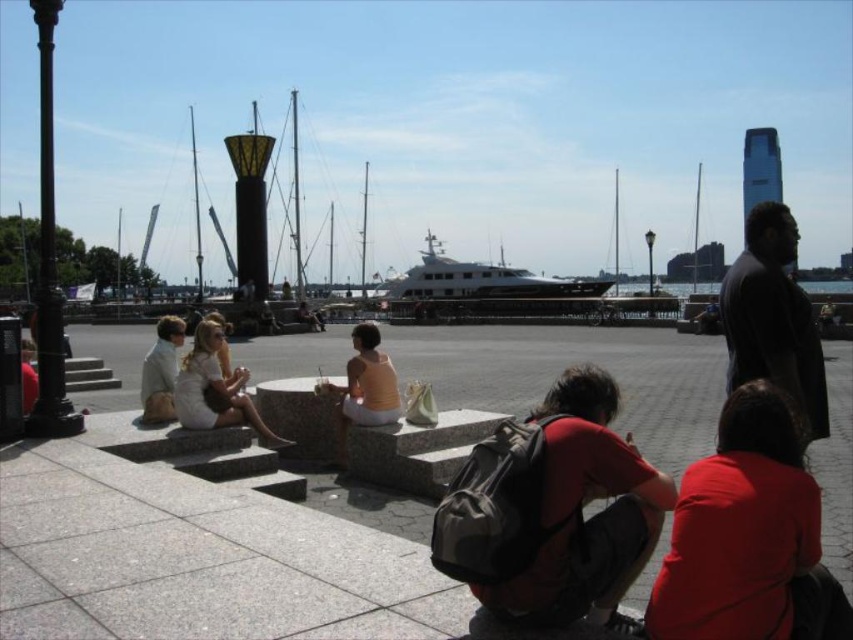
You are standing at the location of the light beige fabric dress at lower left and want to reach the white glossy yacht at center. Given that your walking speed is 1.5 meters per second, how many seconds will it take you to walk directly to the yacht?

The white glossy yacht at center is 51.21 meters away from the light beige fabric dress at lower left. At a speed of 1.5 meters per second, it would take approximately 34.14 seconds to reach the yacht.

You are a photographer trying to capture a photo of the white glossy yacht at center without the matte red shirt at lower right appearing in the foreground. Based on their heights, can you position yourself so that the yacht is fully visible without the shirt blocking it?

The matte red shirt at lower right has a lesser height compared to the white glossy yacht at center, so positioning yourself at a higher angle or moving further back should allow the yacht to be fully visible without the shirt blocking it.

You are a photographer trying to capture the white glossy yacht at center and the matte red shirt at lower right in the same frame. Considering their sizes, which object would appear smaller in your photo?

The matte red shirt at lower right would appear smaller in the photo because it has a smaller size compared to the white glossy yacht at center.